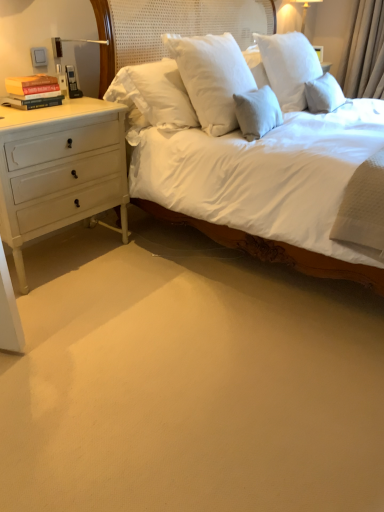
Question: In terms of height, does white glossy lampshade at upper right look taller or shorter compared to hardcover books at left?

Choices:
 (A) tall
 (B) short

Answer: (A)

Question: Based on their positions, is white glossy lampshade at upper right located to the left or right of hardcover books at left?

Choices:
 (A) left
 (B) right

Answer: (B)

Question: Which object is positioned closest to the beige fabric curtain at upper right?

Choices:
 (A) white glossy lampshade at upper right
 (B) hardcover books at left
 (C) white painted wood chest of drawers at left

Answer: (A)

Question: Which object is positioned closest to the white painted wood chest of drawers at left?

Choices:
 (A) beige fabric curtain at upper right
 (B) hardcover books at left
 (C) white glossy lampshade at upper right

Answer: (B)